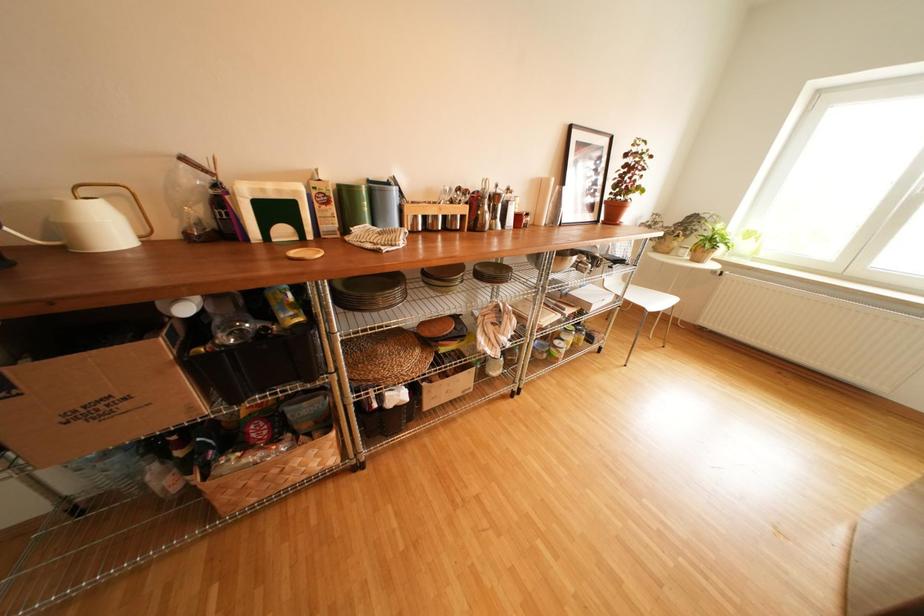
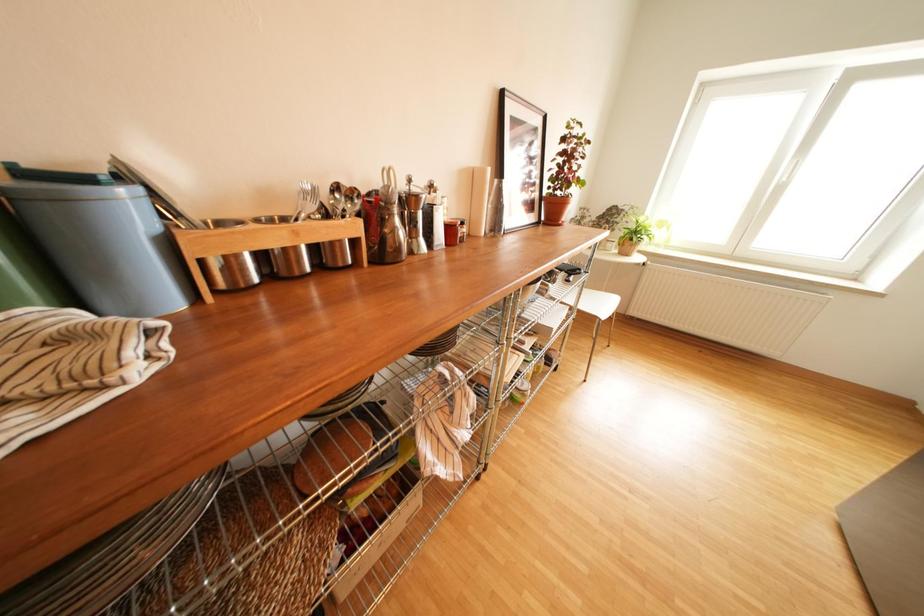
Question: The first image is from the beginning of the video and the second image is from the end. How did the camera likely rotate when shooting the video?

Choices:
 (A) Left
 (B) Right
 (C) Up
 (D) Down

Answer: (B)